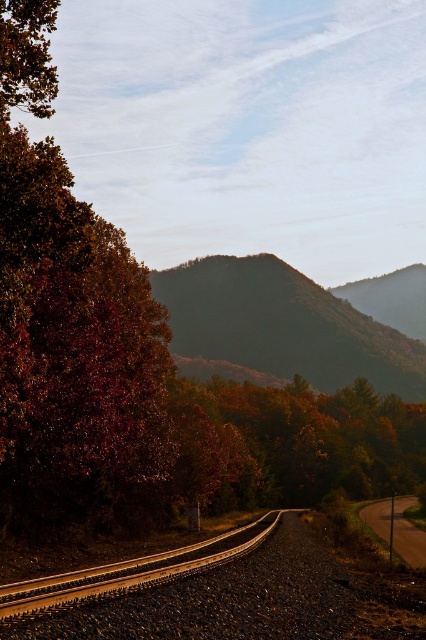
Question: Does shiny brown tree at left have a greater width compared to autumn leaves at center?

Choices:
 (A) no
 (B) yes

Answer: (A)

Question: Is autumn leaves at center thinner than brown gravel track at center?

Choices:
 (A) no
 (B) yes

Answer: (A)

Question: Is shiny brown tree at left positioned behind green matte hillside at center?

Choices:
 (A) yes
 (B) no

Answer: (B)

Question: Which object appears farthest from the camera in this image?

Choices:
 (A) autumn leaves at center
 (B) brown gravel track at center
 (C) green matte hillside at center
 (D) shiny brown tree at left

Answer: (C)

Question: Which point is closer to the camera?

Choices:
 (A) brown gravel track at center
 (B) autumn leaves at center

Answer: (A)

Question: Which of the following is the closest to the observer?

Choices:
 (A) green matte hillside at center
 (B) shiny brown tree at left
 (C) autumn leaves at center
 (D) brown gravel track at center

Answer: (D)